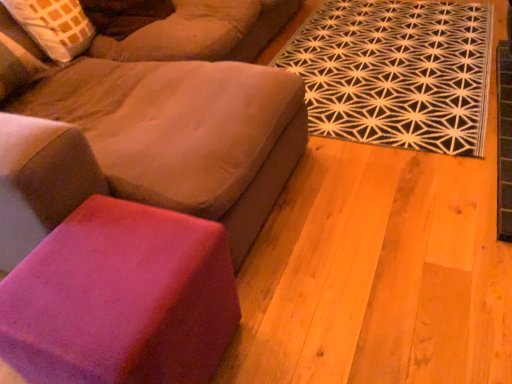
Question: Is purple suede stool at lower left completely or partially inside suede-like beige studio couch at upper left?

Choices:
 (A) no
 (B) yes

Answer: (B)

Question: Does suede-like beige studio couch at upper left have a larger size compared to purple suede stool at lower left?

Choices:
 (A) yes
 (B) no

Answer: (A)

Question: From a real-world perspective, is suede-like beige studio couch at upper left beneath purple suede stool at lower left?

Choices:
 (A) yes
 (B) no

Answer: (B)

Question: Is the depth of suede-like beige studio couch at upper left greater than that of purple suede stool at lower left?

Choices:
 (A) no
 (B) yes

Answer: (A)

Question: Is suede-like beige studio couch at upper left outside of purple suede stool at lower left?

Choices:
 (A) no
 (B) yes

Answer: (B)

Question: From the image's perspective, is black geometric rug at upper right located above or below suede-like beige studio couch at upper left?

Choices:
 (A) below
 (B) above

Answer: (B)

Question: Considering the positions of black geometric rug at upper right and suede-like beige studio couch at upper left in the image, is black geometric rug at upper right wider or thinner than suede-like beige studio couch at upper left?

Choices:
 (A) thin
 (B) wide

Answer: (B)

Question: Considering the relative positions of black geometric rug at upper right and suede-like beige studio couch at upper left in the image provided, is black geometric rug at upper right to the left or to the right of suede-like beige studio couch at upper left?

Choices:
 (A) left
 (B) right

Answer: (B)

Question: Looking at the image, does black geometric rug at upper right seem bigger or smaller compared to suede-like beige studio couch at upper left?

Choices:
 (A) big
 (B) small

Answer: (B)

Question: Is purple suede stool at lower left taller or shorter than suede-like beige studio couch at upper left?

Choices:
 (A) short
 (B) tall

Answer: (A)

Question: From a real-world perspective, is purple suede stool at lower left above or below suede-like beige studio couch at upper left?

Choices:
 (A) below
 (B) above

Answer: (A)

Question: Choose the correct answer: Is purple suede stool at lower left inside suede-like beige studio couch at upper left or outside it?

Choices:
 (A) outside
 (B) inside

Answer: (B)

Question: Is point (202, 246) positioned closer to the camera than point (164, 114)?

Choices:
 (A) farther
 (B) closer

Answer: (B)

Question: In terms of size, does black geometric rug at upper right appear bigger or smaller than purple suede stool at lower left?

Choices:
 (A) big
 (B) small

Answer: (A)

Question: Do you think black geometric rug at upper right is within purple suede stool at lower left, or outside of it?

Choices:
 (A) inside
 (B) outside

Answer: (B)